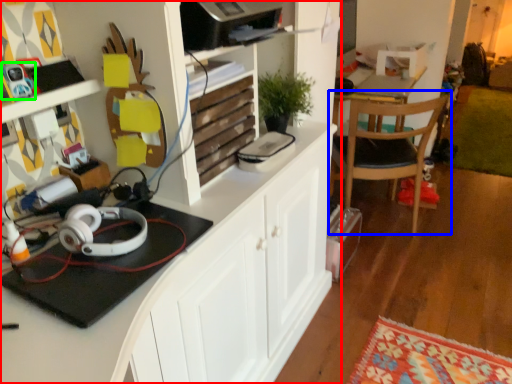
Question: Which object is the farthest from cabinetry (highlighted by a red box)? Choose among these: chair (highlighted by a blue box) or toy (highlighted by a green box).

Choices:
 (A) chair
 (B) toy

Answer: (A)